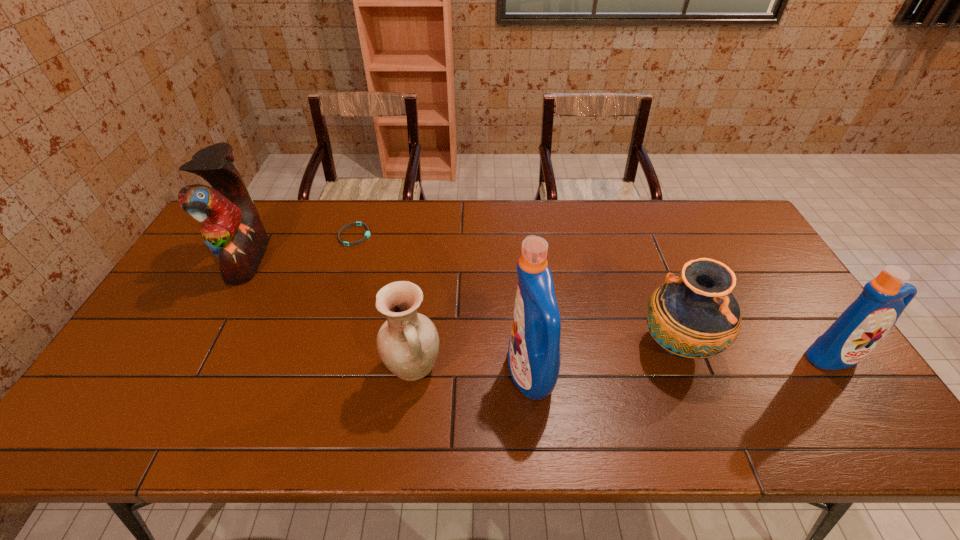
Identify the location of object that is positioned at the right edge. The width and height of the screenshot is (960, 540). (862, 326).

Where is `object that is at the far left corner`? object that is at the far left corner is located at coordinates (231, 227).

In order to click on object located in the near right corner section of the desktop in this screenshot , I will do `click(862, 326)`.

Where is `free region at the far edge`? The image size is (960, 540). free region at the far edge is located at coordinates (645, 233).

Where is `vacant space at the near edge of the desktop`? Image resolution: width=960 pixels, height=540 pixels. vacant space at the near edge of the desktop is located at coordinates (195, 395).

I want to click on blank area at the right edge, so click(x=780, y=359).

Where is `vacant area at the far right corner of the desktop`? vacant area at the far right corner of the desktop is located at coordinates (696, 205).

Identify the location of vacant space that's between the right pottery and the shortest object. Image resolution: width=960 pixels, height=540 pixels. (516, 291).

I want to click on free space between the right pottery and the fourth object from left to right, so click(x=604, y=360).

The height and width of the screenshot is (540, 960). In order to click on blank region between the fourth object from left to right and the rightmost object in this screenshot , I will do `click(683, 365)`.